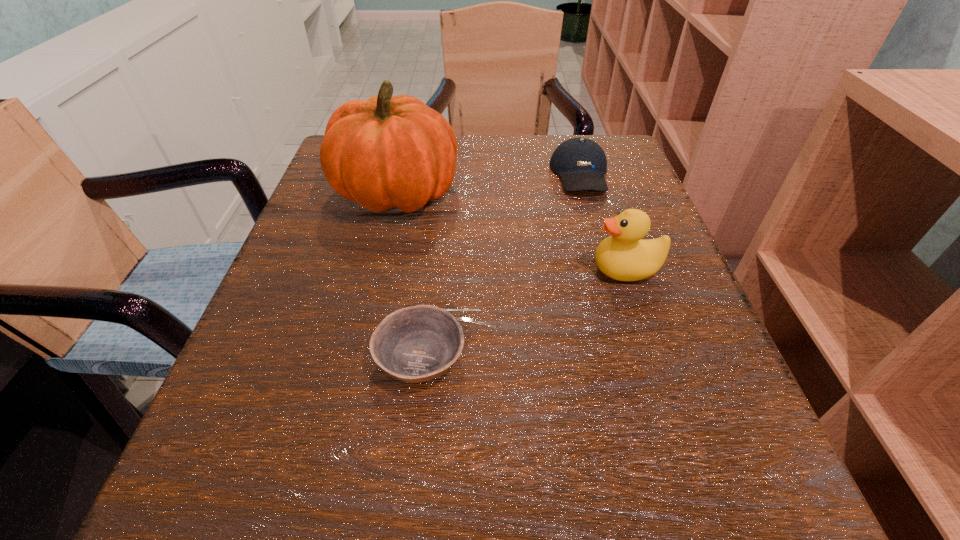
Where is `the tallest object`? the tallest object is located at coordinates (388, 151).

Where is `the third farthest object`? The image size is (960, 540). the third farthest object is located at coordinates (623, 256).

What are the coordinates of `duck` in the screenshot? It's located at point(623,256).

At what (x,y) coordinates should I click in order to perform the action: click on the third tallest object. Please return your answer as a coordinate pair (x, y). The image size is (960, 540). Looking at the image, I should click on tap(581, 163).

This screenshot has width=960, height=540. In order to click on bowl in this screenshot , I will do `click(416, 344)`.

Find the location of a particular element. This screenshot has width=960, height=540. the nearest object is located at coordinates (416, 344).

Locate an element on the screen. The image size is (960, 540). vacant space located on the back of the tallest object is located at coordinates (410, 137).

I want to click on free space located at the beak of the duck, so click(x=448, y=269).

This screenshot has height=540, width=960. I want to click on vacant space located at the beak of the duck, so click(375, 269).

Image resolution: width=960 pixels, height=540 pixels. Identify the location of free space located at the beak of the duck. (406, 269).